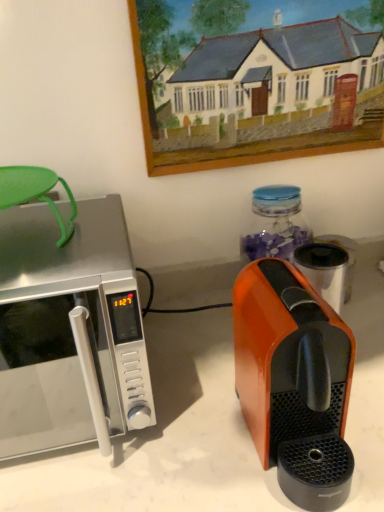
This screenshot has width=384, height=512. I want to click on wooden picture frame at upper center, so click(x=255, y=91).

Is wooden picture frame at upper center oriented towards satin silver microwave at left?

No, wooden picture frame at upper center is not aimed at satin silver microwave at left.

Is wooden picture frame at upper center taller than satin silver microwave at left?

Indeed, wooden picture frame at upper center has a greater height compared to satin silver microwave at left.

Does wooden picture frame at upper center have a smaller size compared to satin silver microwave at left?

Correct, wooden picture frame at upper center occupies less space than satin silver microwave at left.

From a real-world perspective, is wooden picture frame at upper center located beneath satin silver microwave at left?

No.

Between wooden picture frame at upper center and orange glossy coffee maker at right, which one has larger size?

Bigger between the two is orange glossy coffee maker at right.

Could you tell me if wooden picture frame at upper center is facing orange glossy coffee maker at right?

No, wooden picture frame at upper center is not facing towards orange glossy coffee maker at right.

Considering the positions of objects wooden picture frame at upper center and orange glossy coffee maker at right in the image provided, who is in front, wooden picture frame at upper center or orange glossy coffee maker at right?

orange glossy coffee maker at right is closer to the camera.

Can you confirm if satin silver microwave at left is smaller than wooden picture frame at upper center?

No, satin silver microwave at left is not smaller than wooden picture frame at upper center.

In the scene shown: Visually, is satin silver microwave at left positioned to the left or to the right of wooden picture frame at upper center?

Clearly, satin silver microwave at left is on the left of wooden picture frame at upper center in the image.

Is satin silver microwave at left inside or outside of wooden picture frame at upper center?

satin silver microwave at left is not inside wooden picture frame at upper center, it's outside.

Is satin silver microwave at left facing towards wooden picture frame at upper center?

No, satin silver microwave at left is not oriented towards wooden picture frame at upper center.

From a real-world perspective, does orange glossy coffee maker at right sit lower than wooden picture frame at upper center?

Indeed, from a real-world perspective, orange glossy coffee maker at right is positioned beneath wooden picture frame at upper center.

Are orange glossy coffee maker at right and wooden picture frame at upper center far apart?

No, there isn't a large distance between orange glossy coffee maker at right and wooden picture frame at upper center.

Considering the relative sizes of orange glossy coffee maker at right and wooden picture frame at upper center in the image provided, is orange glossy coffee maker at right taller than wooden picture frame at upper center?

In fact, orange glossy coffee maker at right may be shorter than wooden picture frame at upper center.

Is orange glossy coffee maker at right positioned with its back to satin silver microwave at left?

No, orange glossy coffee maker at right is not facing the opposite direction of satin silver microwave at left.

From a real-world perspective, is orange glossy coffee maker at right physically below satin silver microwave at left?

Yes.

Is orange glossy coffee maker at right positioned behind satin silver microwave at left?

No.

Is satin silver microwave at left a part of orange glossy coffee maker at right?

No, satin silver microwave at left is not inside orange glossy coffee maker at right.

Considering the sizes of objects satin silver microwave at left and orange glossy coffee maker at right in the image provided, who is taller, satin silver microwave at left or orange glossy coffee maker at right?

satin silver microwave at left is taller.

Is satin silver microwave at left placed right next to orange glossy coffee maker at right?

No, satin silver microwave at left is not touching orange glossy coffee maker at right.

Is point (81, 309) positioned after point (263, 333)?

Yes, it is behind point (263, 333).

From the image's perspective, between satin silver microwave at left and orange glossy coffee maker at right, who is located below?

orange glossy coffee maker at right.

In the image, there is a satin silver microwave at left. Where is `picture frame above it (from the image's perspective)`? The height and width of the screenshot is (512, 384). picture frame above it (from the image's perspective) is located at coordinates (255, 91).

I want to click on picture frame to the right of orange glossy coffee maker at right, so click(255, 91).

Which object lies nearer to the anchor point orange glossy coffee maker at right, satin silver microwave at left or wooden picture frame at upper center?

Among the two, satin silver microwave at left is located nearer to orange glossy coffee maker at right.

When comparing their distances from wooden picture frame at upper center, does satin silver microwave at left or orange glossy coffee maker at right seem further?

Among the two, orange glossy coffee maker at right is located further to wooden picture frame at upper center.

Which object lies nearer to the anchor point satin silver microwave at left, orange glossy coffee maker at right or wooden picture frame at upper center?

orange glossy coffee maker at right is closer to satin silver microwave at left.

When comparing their distances from wooden picture frame at upper center, does orange glossy coffee maker at right or satin silver microwave at left seem further?

orange glossy coffee maker at right is further to wooden picture frame at upper center.

Estimate the real-world distances between objects in this image. Which object is closer to satin silver microwave at left, wooden picture frame at upper center or orange glossy coffee maker at right?

orange glossy coffee maker at right lies closer to satin silver microwave at left than the other object.

When comparing their distances from orange glossy coffee maker at right, does wooden picture frame at upper center or satin silver microwave at left seem further?

wooden picture frame at upper center lies further to orange glossy coffee maker at right than the other object.

This screenshot has width=384, height=512. Find the location of `microwave oven between wooden picture frame at upper center and orange glossy coffee maker at right in the up-down direction`. microwave oven between wooden picture frame at upper center and orange glossy coffee maker at right in the up-down direction is located at coordinates (69, 331).